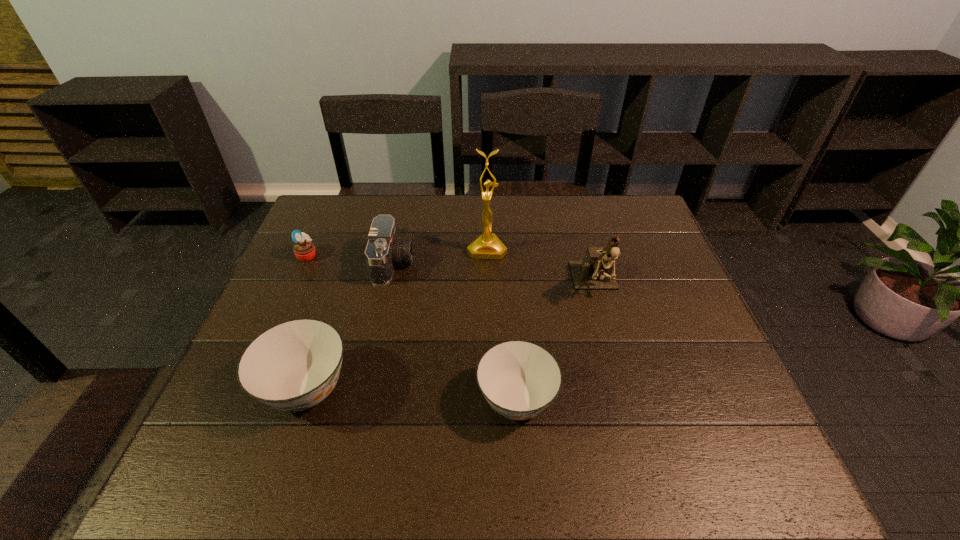
Identify the location of the left soup bowl. (294, 365).

Locate an element on the screen. the right soup bowl is located at coordinates (519, 379).

Where is `the tallest object`? The height and width of the screenshot is (540, 960). the tallest object is located at coordinates (488, 246).

This screenshot has height=540, width=960. I want to click on camera, so click(x=383, y=251).

This screenshot has width=960, height=540. What are the coordinates of `muffin` in the screenshot? It's located at (304, 250).

The width and height of the screenshot is (960, 540). Find the location of `the fifth shortest object`. the fifth shortest object is located at coordinates (597, 270).

The image size is (960, 540). Find the location of `the rightmost object`. the rightmost object is located at coordinates (597, 270).

Find the location of `free location located on the back of the left soup bowl`. free location located on the back of the left soup bowl is located at coordinates (331, 313).

The height and width of the screenshot is (540, 960). Identify the location of free space located on the back of the right soup bowl. (511, 309).

Image resolution: width=960 pixels, height=540 pixels. Find the location of `vacant space located on the front-facing side of the award`. vacant space located on the front-facing side of the award is located at coordinates (489, 316).